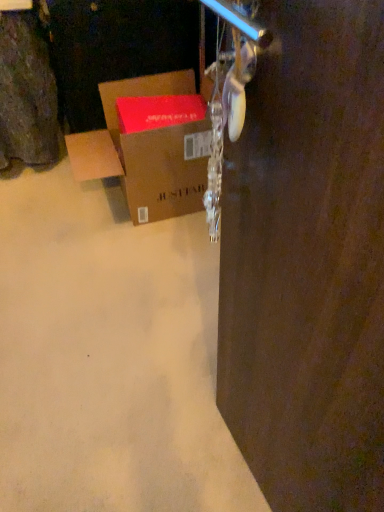
Question: Should I look upward or downward to see brown cardboard box at center?

Choices:
 (A) down
 (B) up

Answer: (B)